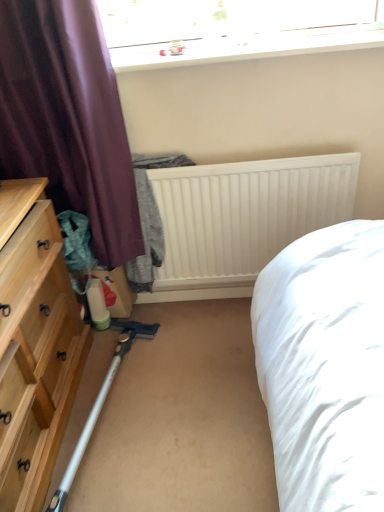
The image size is (384, 512). I want to click on vacant space to the right of white plastic vacuum cleaner at lower left, so click(x=200, y=402).